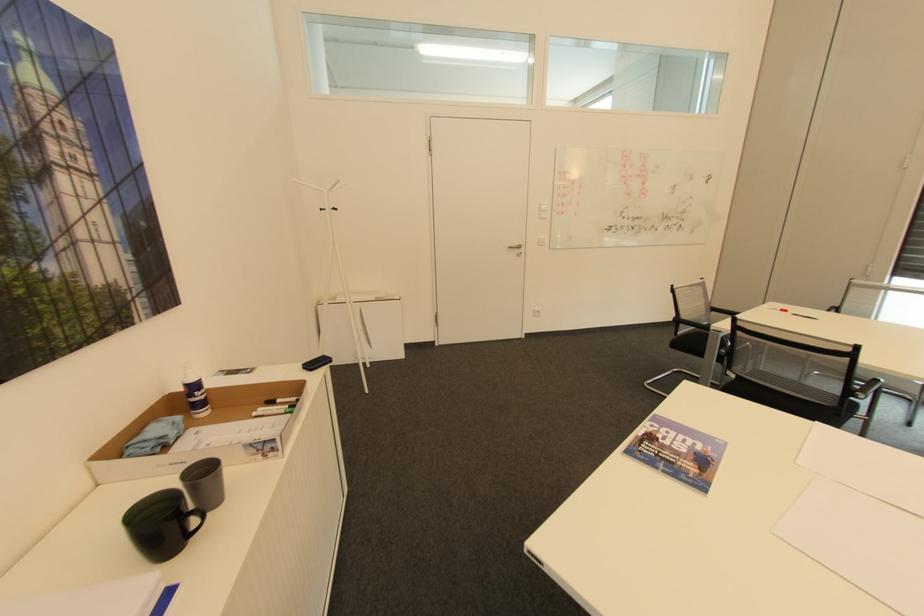
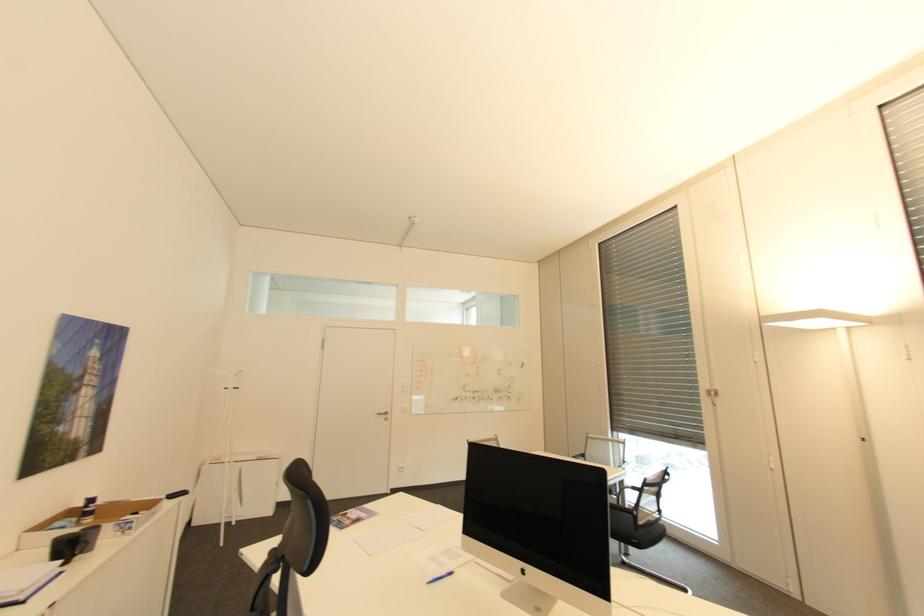
In the second image, find the point that corresponds to (524,246) in the first image.

(391, 413)